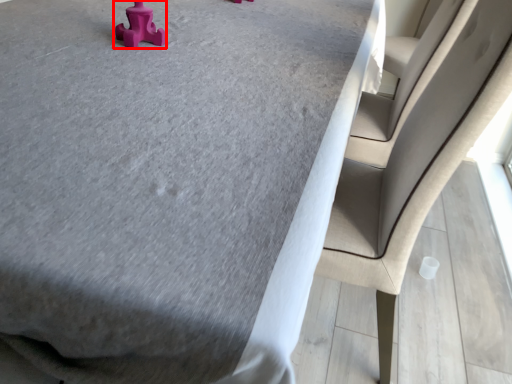
Question: From the image, what is the correct spatial relationship of toy (annotated by the red box) in relation to chair?

Choices:
 (A) right
 (B) left

Answer: (B)